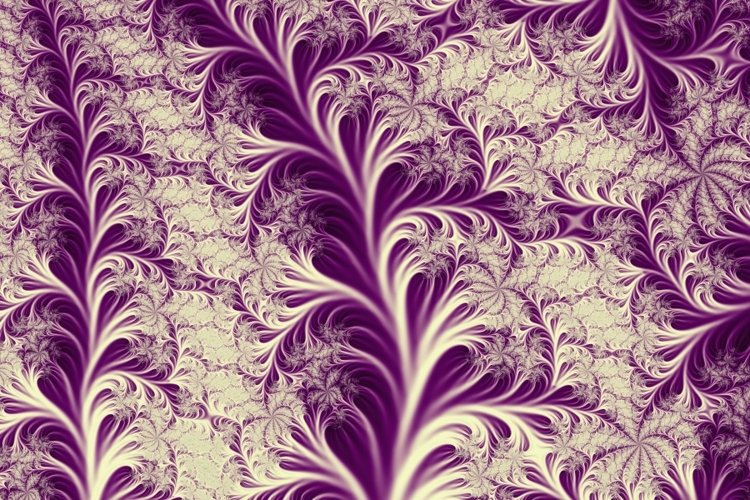
This screenshot has height=500, width=750. I want to click on upside down plant, so click(610, 10).